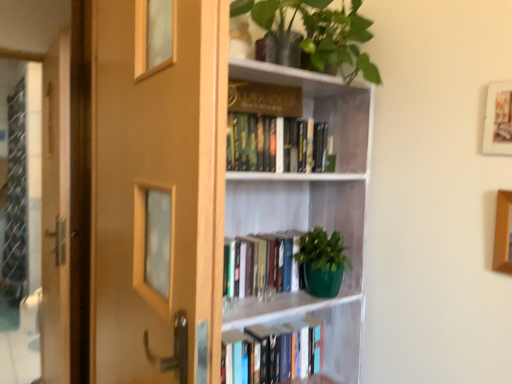
Question: Does wooden picture frame at upper right, placed as the 2th picture frame when sorted from top to bottom, have a greater width compared to hardcover book at center, which appears as the fourth book when viewed from the top?

Choices:
 (A) no
 (B) yes

Answer: (A)

Question: Does wooden picture frame at upper right, which is the 1th picture frame in bottom-to-top order, have a lesser height compared to hardcover book at center, which appears as the fourth book when viewed from the top?

Choices:
 (A) no
 (B) yes

Answer: (A)

Question: From the image's perspective, does wooden picture frame at upper right, which is the 1th picture frame in bottom-to-top order, appear lower than hardcover book at center, which appears as the fourth book when viewed from the top?

Choices:
 (A) no
 (B) yes

Answer: (A)

Question: Is wooden picture frame at upper right, placed as the 2th picture frame when sorted from top to bottom, facing towards hardcover book at center, which appears as the fourth book when viewed from the top?

Choices:
 (A) yes
 (B) no

Answer: (B)

Question: Is wooden picture frame at upper right, placed as the 2th picture frame when sorted from top to bottom, located outside hardcover book at center, which appears as the fourth book when viewed from the top?

Choices:
 (A) yes
 (B) no

Answer: (A)

Question: In terms of width, does wooden screen door at left look wider or thinner when compared to gold hardcover book at upper center, positioned as the 4th book in bottom-to-top order?

Choices:
 (A) wide
 (B) thin

Answer: (A)

Question: Is wooden screen door at left taller or shorter than gold hardcover book at upper center, which appears as the first book when viewed from the top?

Choices:
 (A) short
 (B) tall

Answer: (B)

Question: From a real-world perspective, is wooden screen door at left positioned above or below gold hardcover book at upper center, positioned as the 4th book in bottom-to-top order?

Choices:
 (A) below
 (B) above

Answer: (A)

Question: Is wooden screen door at left inside or outside of gold hardcover book at upper center, positioned as the 4th book in bottom-to-top order?

Choices:
 (A) inside
 (B) outside

Answer: (B)

Question: Is wooden screen door at left wider or thinner than green matte plant at upper center?

Choices:
 (A) wide
 (B) thin

Answer: (B)

Question: From a real-world perspective, is wooden screen door at left above or below green matte plant at upper center?

Choices:
 (A) below
 (B) above

Answer: (A)

Question: Is point (48, 296) positioned closer to the camera than point (288, 28)?

Choices:
 (A) closer
 (B) farther

Answer: (B)

Question: Considering the positions of wooden screen door at left and green matte plant at upper center in the image, is wooden screen door at left bigger or smaller than green matte plant at upper center?

Choices:
 (A) small
 (B) big

Answer: (B)

Question: In terms of height, does wooden picture frame at upper right, placed as the 2th picture frame when sorted from top to bottom, look taller or shorter compared to hardcover books at upper center, which is counted as the second book, starting from the top?

Choices:
 (A) short
 (B) tall

Answer: (B)

Question: Is wooden picture frame at upper right, placed as the 2th picture frame when sorted from top to bottom, wider or thinner than hardcover books at upper center, which is counted as the second book, starting from the top?

Choices:
 (A) wide
 (B) thin

Answer: (B)